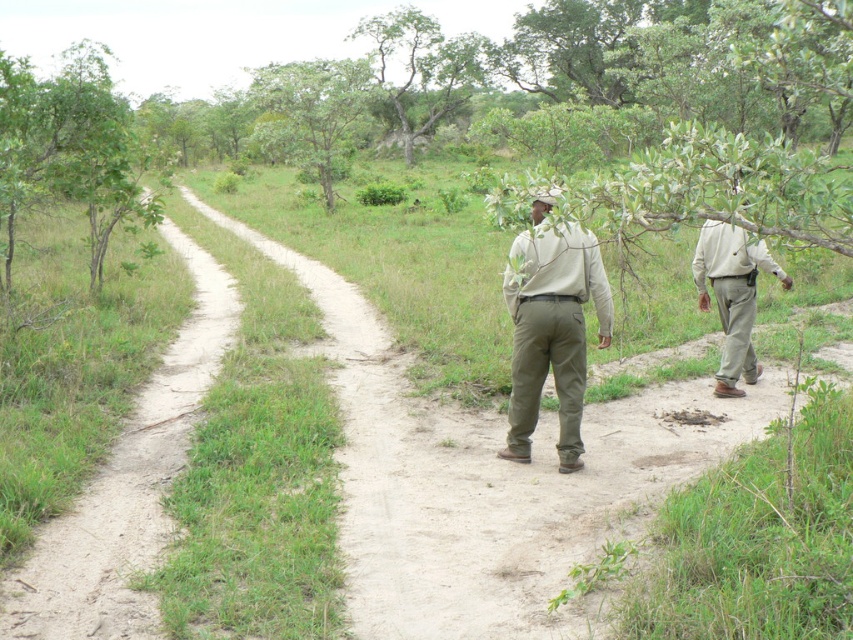
Question: Which point is closer to the camera?

Choices:
 (A) (297, 125)
 (B) (379, 52)
 (C) (577, 406)
 (D) (743, 234)

Answer: (C)

Question: Can you confirm if green leafy tree at upper center is positioned to the right of khaki pants at right?

Choices:
 (A) no
 (B) yes

Answer: (A)

Question: Does green leafy tree at upper left appear under khaki pants at right?

Choices:
 (A) no
 (B) yes

Answer: (A)

Question: Which of the following is the farthest from the observer?

Choices:
 (A) (752, 305)
 (B) (349, 97)

Answer: (B)

Question: Which of the following is the farthest from the observer?

Choices:
 (A) green leafy tree at center
 (B) green leafy tree at upper center
 (C) green leafy tree at upper left
 (D) khaki cotton pants at center

Answer: (B)

Question: Is khaki cotton pants at center to the right of green leafy tree at center from the viewer's perspective?

Choices:
 (A) yes
 (B) no

Answer: (A)